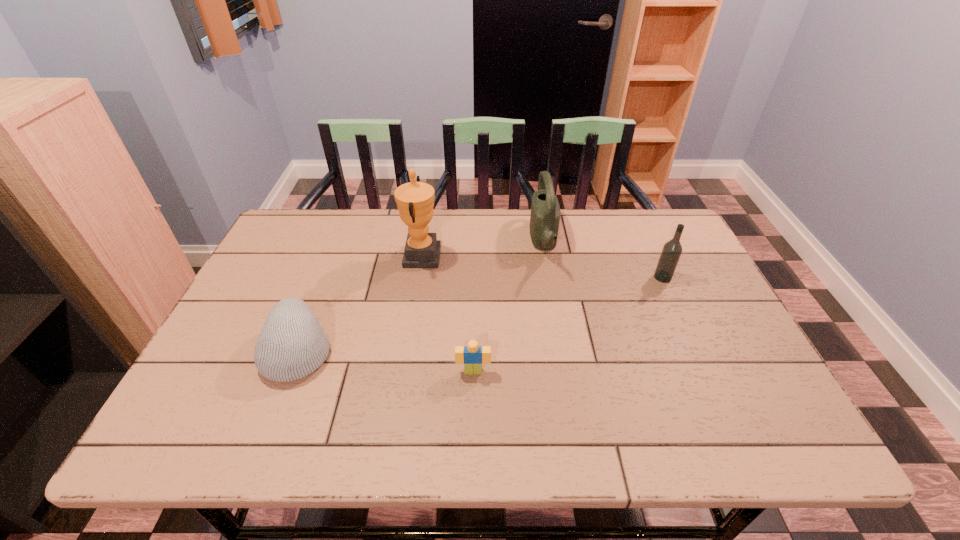
I want to click on unoccupied position between the fourth tallest object and the tallest object, so click(360, 303).

Image resolution: width=960 pixels, height=540 pixels. I want to click on vacant area that lies between the award and the watering can, so point(483,249).

Locate an element on the screen. The width and height of the screenshot is (960, 540). vacant area that lies between the watering can and the Lego is located at coordinates [x=509, y=307].

I want to click on free space that is in between the third object from left to right and the vodka, so click(568, 324).

This screenshot has width=960, height=540. I want to click on the fourth closest object to the second object from right to left, so [292, 344].

Find the location of a particular element. The height and width of the screenshot is (540, 960). object that is the nearest to the second shortest object is located at coordinates (415, 200).

At what (x,y) coordinates should I click in order to perform the action: click on vacant space that satisfies the following two spatial constraints: 1. on the spout of the fourth object from left to right; 2. on the face of the Lego. Please return your answer as a coordinate pair (x, y). Image resolution: width=960 pixels, height=540 pixels. Looking at the image, I should click on (566, 372).

This screenshot has width=960, height=540. Find the location of `free space in the image that satisfies the following two spatial constraints: 1. at the front of the award with handles; 2. on the right side of the rightmost object`. free space in the image that satisfies the following two spatial constraints: 1. at the front of the award with handles; 2. on the right side of the rightmost object is located at coordinates (419, 277).

This screenshot has height=540, width=960. Identify the location of free space that satisfies the following two spatial constraints: 1. on the back side of the rightmost object; 2. at the front of the award with handles. (654, 257).

The height and width of the screenshot is (540, 960). What are the coordinates of `free location that satisfies the following two spatial constraints: 1. on the back side of the vodka; 2. on the left side of the beanie` in the screenshot? It's located at click(x=326, y=277).